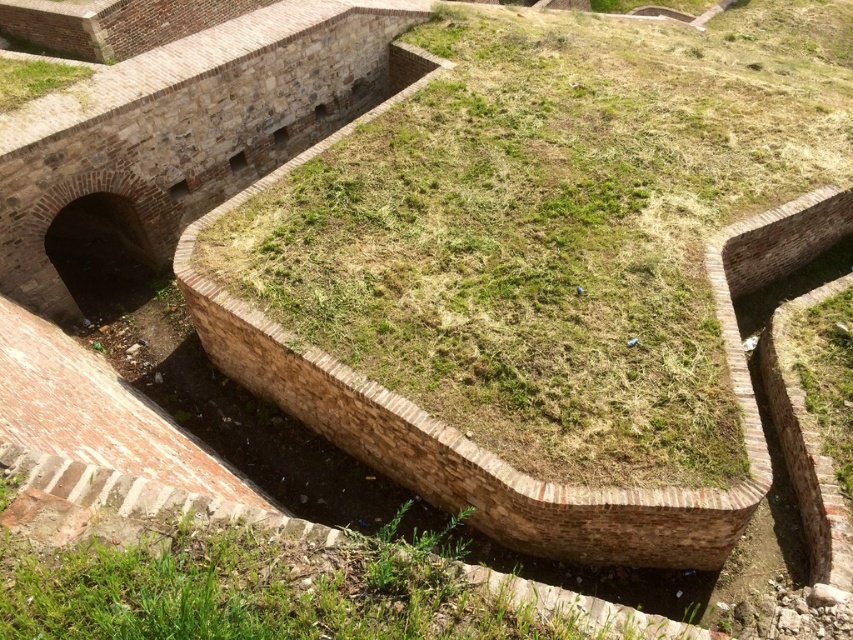
Question: Which object is farther from the camera taking this photo?

Choices:
 (A) green grassy at center
 (B) green grassy at upper left

Answer: (B)

Question: In this image, where is green grassy at center located relative to green grassy at upper left?

Choices:
 (A) right
 (B) left

Answer: (A)

Question: Among these objects, which one is nearest to the camera?

Choices:
 (A) green grassy at upper left
 (B) green grassy at center

Answer: (B)

Question: Considering the relative positions of green grassy at center and green grassy at upper left in the image provided, where is green grassy at center located with respect to green grassy at upper left?

Choices:
 (A) below
 (B) above

Answer: (A)

Question: Is green grassy at center wider than green grassy at upper left?

Choices:
 (A) yes
 (B) no

Answer: (A)

Question: Which of the following is the closest to the observer?

Choices:
 (A) green grassy at center
 (B) green grassy at upper left

Answer: (A)